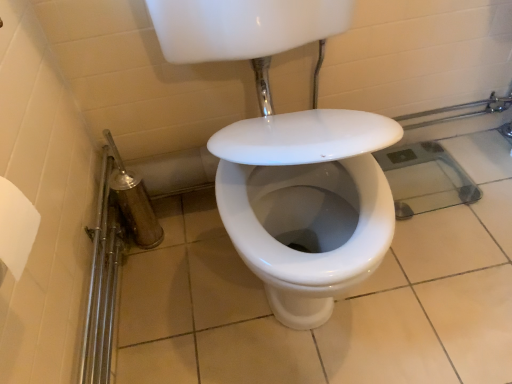
Identify the location of unoccupied region to the right of shiny metallic shower at lower left. The width and height of the screenshot is (512, 384). (196, 235).